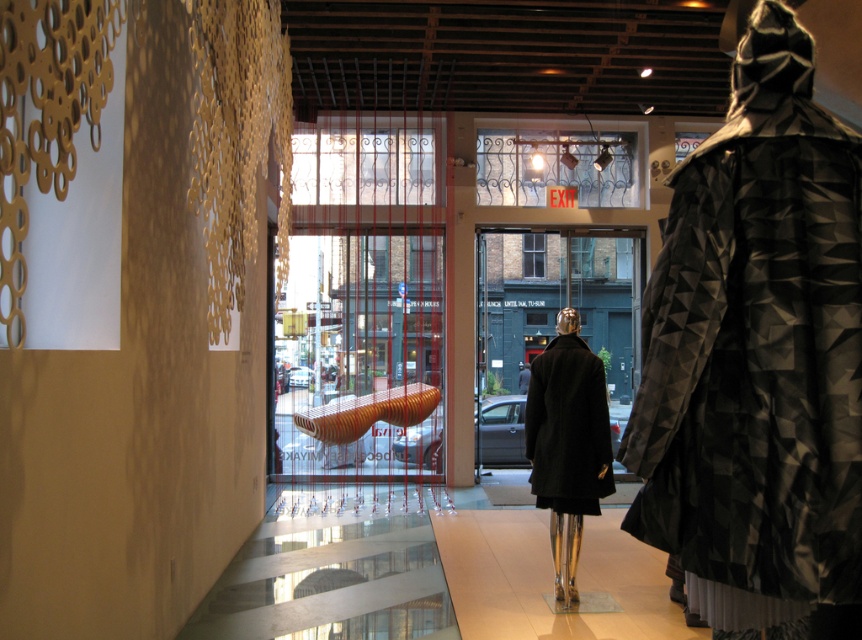
Is geometric-patterned coat at right wider than black wool coat at center?

Yes, geometric-patterned coat at right is wider than black wool coat at center.

Who is lower down, geometric-patterned coat at right or black wool coat at center?

black wool coat at center is lower down.

Identify the location of geometric-patterned coat at right. (759, 358).

At what (x,y) coordinates should I click in order to perform the action: click on geometric-patterned coat at right. Please return your answer as a coordinate pair (x, y). The height and width of the screenshot is (640, 862). Looking at the image, I should click on (759, 358).